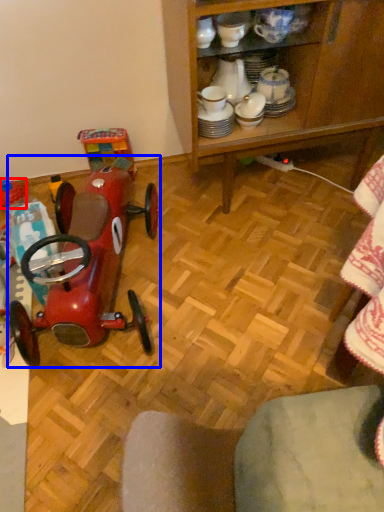
Question: Which object is closer to the camera taking this photo, toy (highlighted by a red box) or toy (highlighted by a blue box)?

Choices:
 (A) toy
 (B) toy

Answer: (B)